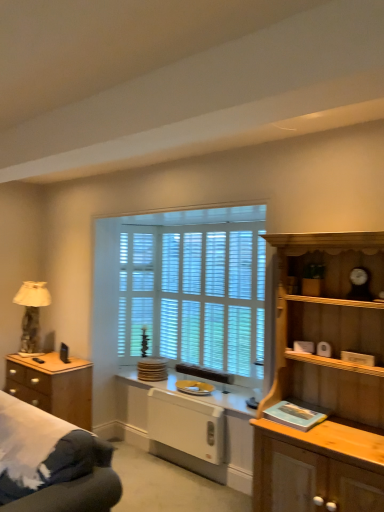
Question: From the image's perspective, does white wood blinds at center appear lower than beige fabric lampshade at left?

Choices:
 (A) yes
 (B) no

Answer: (B)

Question: Is white wood blinds at center oriented away from beige fabric lampshade at left?

Choices:
 (A) no
 (B) yes

Answer: (A)

Question: Does white wood blinds at center touch beige fabric lampshade at left?

Choices:
 (A) no
 (B) yes

Answer: (A)

Question: Would you say white wood blinds at center is outside beige fabric lampshade at left?

Choices:
 (A) yes
 (B) no

Answer: (A)

Question: Can you confirm if white wood blinds at center is positioned to the right of beige fabric lampshade at left?

Choices:
 (A) no
 (B) yes

Answer: (B)

Question: Is light wood cabinet at right spatially inside white wood blinds at center, or outside of it?

Choices:
 (A) inside
 (B) outside

Answer: (B)

Question: From their relative heights in the image, would you say light wood cabinet at right is taller or shorter than white wood blinds at center?

Choices:
 (A) tall
 (B) short

Answer: (A)

Question: From a real-world perspective, is light wood cabinet at right above or below white wood blinds at center?

Choices:
 (A) above
 (B) below

Answer: (B)

Question: Considering the positions of point (362, 398) and point (261, 242), is point (362, 398) closer or farther from the camera than point (261, 242)?

Choices:
 (A) closer
 (B) farther

Answer: (A)

Question: Would you say white glossy plate at center, the 1th appliance when ordered from top to bottom, is to the left or to the right of white wood blinds at center in the picture?

Choices:
 (A) right
 (B) left

Answer: (B)

Question: From a real-world perspective, is white glossy plate at center, which is counted as the 2th appliance, starting from the bottom, positioned above or below white wood blinds at center?

Choices:
 (A) above
 (B) below

Answer: (B)

Question: Is white glossy plate at center, the 1th appliance when ordered from top to bottom, in front of or behind white wood blinds at center in the image?

Choices:
 (A) front
 (B) behind

Answer: (A)

Question: Is white glossy plate at center, which is counted as the 2th appliance, starting from the bottom, bigger or smaller than white wood blinds at center?

Choices:
 (A) big
 (B) small

Answer: (B)

Question: Is point (241, 400) positioned closer to the camera than point (79, 387)?

Choices:
 (A) closer
 (B) farther

Answer: (A)

Question: Would you say white glossy countertop at center is to the left or to the right of brown wooden chest of drawers at left in the picture?

Choices:
 (A) left
 (B) right

Answer: (B)